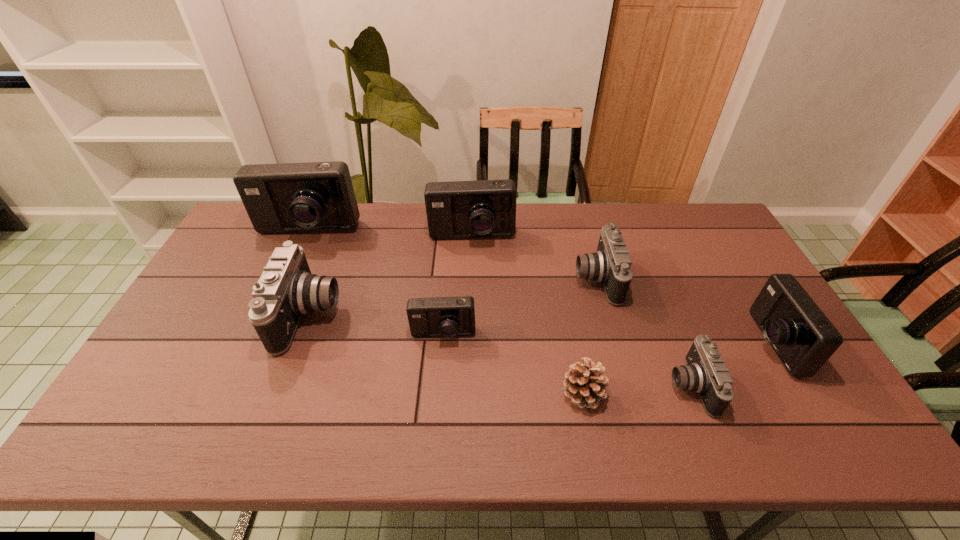
At what (x,y) coordinates should I click in order to perform the action: click on vacant area that lies between the second camera from right to left and the third smallest blue camera. Please return your answer as a coordinate pair (x, y). The height and width of the screenshot is (540, 960). Looking at the image, I should click on (581, 312).

Where is `empty space that is in between the second black camera from left to right and the tallest object`? The image size is (960, 540). empty space that is in between the second black camera from left to right and the tallest object is located at coordinates (451, 255).

Locate an element on the screen. Image resolution: width=960 pixels, height=540 pixels. vacant point located between the biggest black camera and the rightmost camera is located at coordinates (540, 329).

You are a GUI agent. You are given a task and a screenshot of the screen. Output one action in this format:
    pyautogui.click(x=<x>, y=<y>)
    Task: Click on the vacant area that lies between the rightmost object and the smallest blue camera
    Image resolution: width=960 pixels, height=540 pixels.
    Given the screenshot: What is the action you would take?
    pyautogui.click(x=607, y=339)

Identify the location of unoccupied area between the third camera from right to left and the second biggest blue camera. (534, 258).

Locate an element on the screen. free point between the brown pinecone and the second object from right to left is located at coordinates (636, 390).

Where is `object that is the third closest to the leftmost black camera`? The image size is (960, 540). object that is the third closest to the leftmost black camera is located at coordinates (484, 208).

Locate an element on the screen. Image resolution: width=960 pixels, height=540 pixels. object that ranks as the seventh closest to the rightmost blue camera is located at coordinates (316, 196).

Where is `camera that is the fourth nearest to the smallest blue camera`? The height and width of the screenshot is (540, 960). camera that is the fourth nearest to the smallest blue camera is located at coordinates (316, 196).

Locate which camera ranks sixth in proximity to the smallest blue camera. Please provide its 2D coordinates. Your answer should be formatted as a tuple, i.e. [(x, y)], where the tuple contains the x and y coordinates of a point satisfying the conditions above.

[(803, 338)]